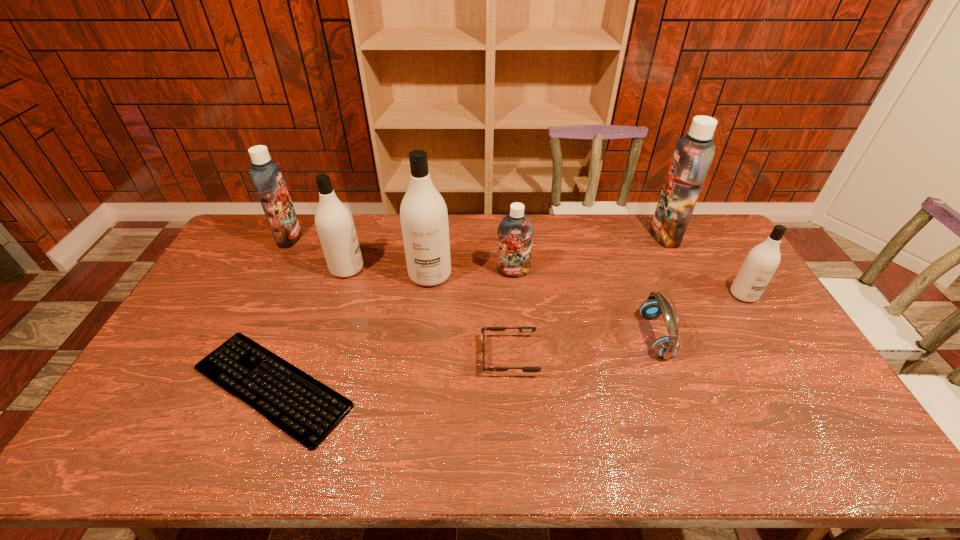
Identify the location of free space located 0.290m on the front-facing side of the second white shampoo from left to right. The image size is (960, 540). (420, 362).

Locate an element on the screen. This screenshot has height=540, width=960. vacant space located on the front label of the leftmost blue shampoo is located at coordinates (354, 238).

Where is `free space located 0.220m on the front-facing side of the leftmost white shampoo`? This screenshot has height=540, width=960. free space located 0.220m on the front-facing side of the leftmost white shampoo is located at coordinates (427, 268).

Where is `free spot located on the front label of the second blue shampoo from right to left`? The height and width of the screenshot is (540, 960). free spot located on the front label of the second blue shampoo from right to left is located at coordinates (516, 321).

You are a GUI agent. You are given a task and a screenshot of the screen. Output one action in this format:
    pyautogui.click(x=<x>, y=<y>)
    Task: Click on the vacant space located on the front-facing side of the rightmost object
    This screenshot has width=960, height=540.
    Given the screenshot: What is the action you would take?
    pyautogui.click(x=792, y=373)

Where is `free space located 0.060m on the ear cups of the seventh object from left to right`? The width and height of the screenshot is (960, 540). free space located 0.060m on the ear cups of the seventh object from left to right is located at coordinates (624, 335).

Locate an element on the screen. The image size is (960, 540). free space located on the ear cups of the seventh object from left to right is located at coordinates (580, 335).

Find the location of `free space located on the ear cups of the seventh object from left to right`. free space located on the ear cups of the seventh object from left to right is located at coordinates (537, 335).

Identify the location of vacant space located on the temples of the sunglasses. (411, 356).

Locate an element on the screen. The width and height of the screenshot is (960, 540). vacant space located on the temples of the sunglasses is located at coordinates (435, 356).